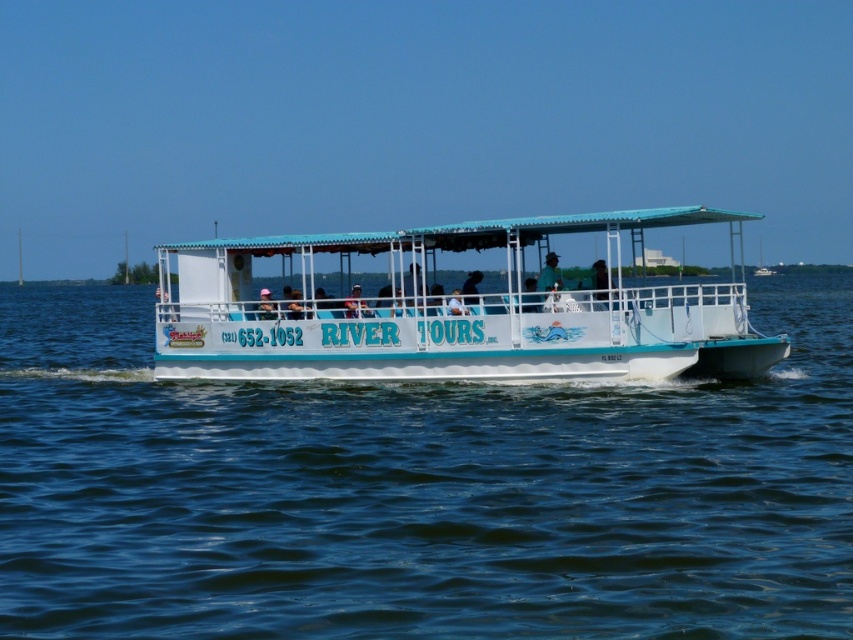
Does blue water at center appear under white plastic hat at center?

Indeed, blue water at center is positioned under white plastic hat at center.

Image resolution: width=853 pixels, height=640 pixels. What do you see at coordinates (418, 492) in the screenshot?
I see `blue water at center` at bounding box center [418, 492].

In order to click on blue water at center in this screenshot , I will do `click(418, 492)`.

Who is positioned more to the left, black fabric at center or white plastic hat at center?

Positioned to the left is white plastic hat at center.

Is black fabric at center positioned at the back of white plastic hat at center?

No, black fabric at center is closer to the viewer.

Is point (614, 298) positioned in front of point (264, 294)?

Yes.

At what (x,y) coordinates should I click in order to perform the action: click on black fabric at center. Please return your answer as a coordinate pair (x, y). This screenshot has height=640, width=853. Looking at the image, I should click on (601, 280).

Does blue water at center have a lesser width compared to blue fabric shirt at center?

In fact, blue water at center might be wider than blue fabric shirt at center.

Identify the location of blue water at center. point(418,492).

At what (x,y) coordinates should I click in order to perform the action: click on blue water at center. Please return your answer as a coordinate pair (x, y). This screenshot has height=640, width=853. Looking at the image, I should click on (418, 492).